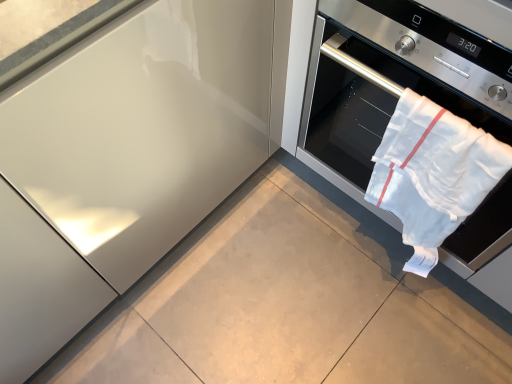
The height and width of the screenshot is (384, 512). Describe the element at coordinates (395, 80) in the screenshot. I see `white cloth oven at right` at that location.

You are a GUI agent. You are given a task and a screenshot of the screen. Output one action in this format:
    pyautogui.click(x=<x>, y=<y>)
    Task: Click on the white cloth oven at right
    
    Given the screenshot: What is the action you would take?
    pyautogui.click(x=395, y=80)

What is the approximate height of white cloth oven at right?

74.82 centimeters.

Describe the element at coordinates (433, 171) in the screenshot. I see `white cotton towel at right` at that location.

Where is `white cotton towel at right`? The image size is (512, 384). white cotton towel at right is located at coordinates (433, 171).

In order to click on white cloth oven at right in this screenshot , I will do (x=395, y=80).

Which object is positioned more to the left, white cloth oven at right or white cotton towel at right?

white cotton towel at right.

Considering the positions of objects white cloth oven at right and white cotton towel at right in the image provided, who is behind, white cloth oven at right or white cotton towel at right?

white cotton towel at right is more distant.

Between point (498, 73) and point (416, 96), which one is positioned in front?

Positioned in front is point (498, 73).

From the image's perspective, is white cloth oven at right above white cotton towel at right?

Yes, from the image's perspective, white cloth oven at right is over white cotton towel at right.

From a real-world perspective, is white cloth oven at right located higher than white cotton towel at right?

Yes, from a real-world perspective, white cloth oven at right is on top of white cotton towel at right.

Between white cloth oven at right and white cotton towel at right, which one has larger width?

With larger width is white cloth oven at right.

Considering the sizes of white cloth oven at right and white cotton towel at right in the image, is white cloth oven at right taller or shorter than white cotton towel at right?

Considering their sizes, white cloth oven at right has more height than white cotton towel at right.

Between white cloth oven at right and white cotton towel at right, which one has smaller size?

white cotton towel at right is smaller.

Can white cotton towel at right be found inside white cloth oven at right?

Absolutely, white cotton towel at right is inside white cloth oven at right.

Is the surface of white cloth oven at right in direct contact with white cotton towel at right?

white cloth oven at right and white cotton towel at right are clearly separated.

Could you tell me if white cloth oven at right is turned towards white cotton towel at right?

Yes, white cloth oven at right is facing white cotton towel at right.

What's the angular difference between white cloth oven at right and white cotton towel at right's facing directions?

They differ by 0.000716 degrees in their facing directions.

Measure the distance from white cloth oven at right to white cotton towel at right.

white cloth oven at right is 4.12 inches from white cotton towel at right.

This screenshot has height=384, width=512. I want to click on beach towel on the left side of white cloth oven at right, so click(x=433, y=171).

Is white cotton towel at right at the left side of white cloth oven at right?

Correct, you'll find white cotton towel at right to the left of white cloth oven at right.

Which object is more forward, white cotton towel at right or white cloth oven at right?

white cloth oven at right is in front.

Does point (463, 202) come behind point (502, 238)?

No, it is in front of (502, 238).

From the image's perspective, is white cotton towel at right positioned above or below white cloth oven at right?

white cotton towel at right is below white cloth oven at right.

From a real-world perspective, is white cotton towel at right physically located above or below white cloth oven at right?

In terms of real-world spatial position, white cotton towel at right is below white cloth oven at right.

In the scene shown: Which object is wider, white cotton towel at right or white cloth oven at right?

With larger width is white cloth oven at right.

From their relative heights in the image, would you say white cotton towel at right is taller or shorter than white cloth oven at right?

Clearly, white cotton towel at right is shorter compared to white cloth oven at right.

Can you confirm if white cotton towel at right is smaller than white cloth oven at right?

Yes, white cotton towel at right is smaller than white cloth oven at right.

Would you say white cotton towel at right is outside white cloth oven at right?

No, white cotton towel at right is inside white cloth oven at right's boundary.

From the picture: Can you see white cotton towel at right touching white cloth oven at right?

white cotton towel at right is not next to white cloth oven at right, and they're not touching.

Is white cotton towel at right oriented towards white cloth oven at right?

No, white cotton towel at right is not turned towards white cloth oven at right.

How many degrees apart are the facing directions of white cotton towel at right and white cloth oven at right?

0.000716 degrees.

Locate an element on the screen. This screenshot has height=384, width=512. home appliance located in front of the white cotton towel at right is located at coordinates (395, 80).

You are a GUI agent. You are given a task and a screenshot of the screen. Output one action in this format:
    pyautogui.click(x=<x>, y=<y>)
    Task: Click on the home appliance above the white cotton towel at right (from the image's perspective)
    
    Given the screenshot: What is the action you would take?
    pyautogui.click(x=395, y=80)

Locate an element on the screen. beach towel lying below the white cloth oven at right (from the image's perspective) is located at coordinates (433, 171).